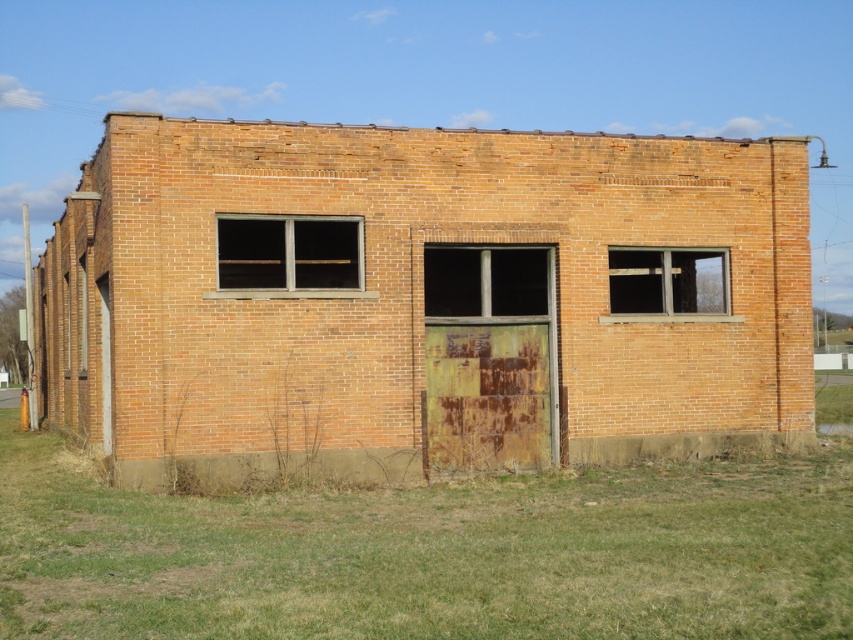
You are a window installer assessing the building. You need to replace the clear glass window at center and the matte gray window at center right. Which window requires a wider replacement pane?

The matte gray window at center right requires a wider replacement pane because the clear glass window at center has a lesser width compared to matte gray window at center right.

You are standing in front of an old abandoned brick building. You see green grass at lower center and a matte gray window at center right. Which object is closer to you?

The green grass at lower center is closer to the viewer than the matte gray window at center right.